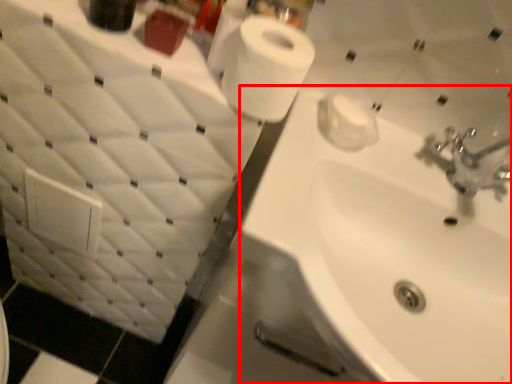
Question: Where is sink (annotated by the red box) located in relation to toilet paper in the image?

Choices:
 (A) right
 (B) left

Answer: (A)